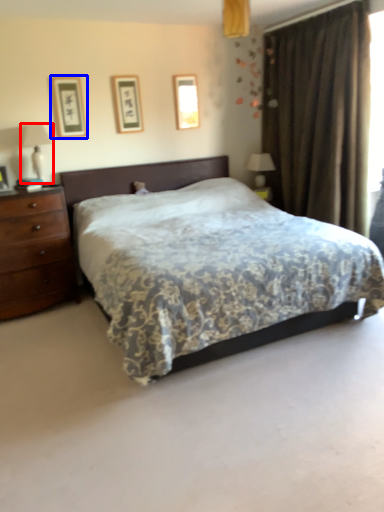
Question: Which point is further to the camera, table lamp (highlighted by a red box) or picture frame (highlighted by a blue box)?

Choices:
 (A) table lamp
 (B) picture frame

Answer: (B)